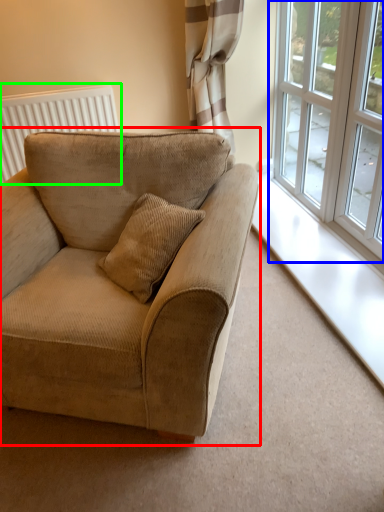
Question: Estimate the real-world distances between objects in this image. Which object is closer to studio couch (highlighted by a red box), window (highlighted by a blue box) or radiator (highlighted by a green box)?

Choices:
 (A) window
 (B) radiator

Answer: (A)